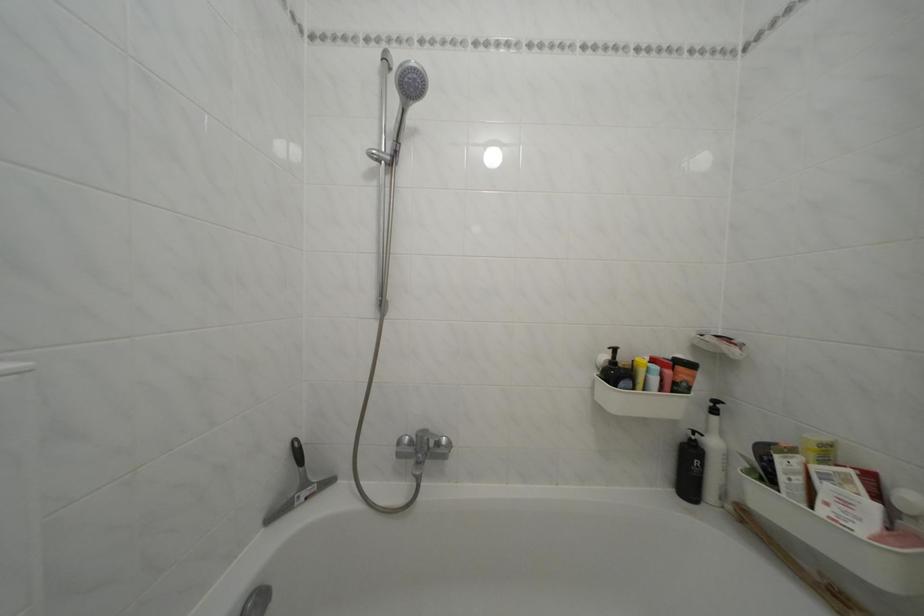
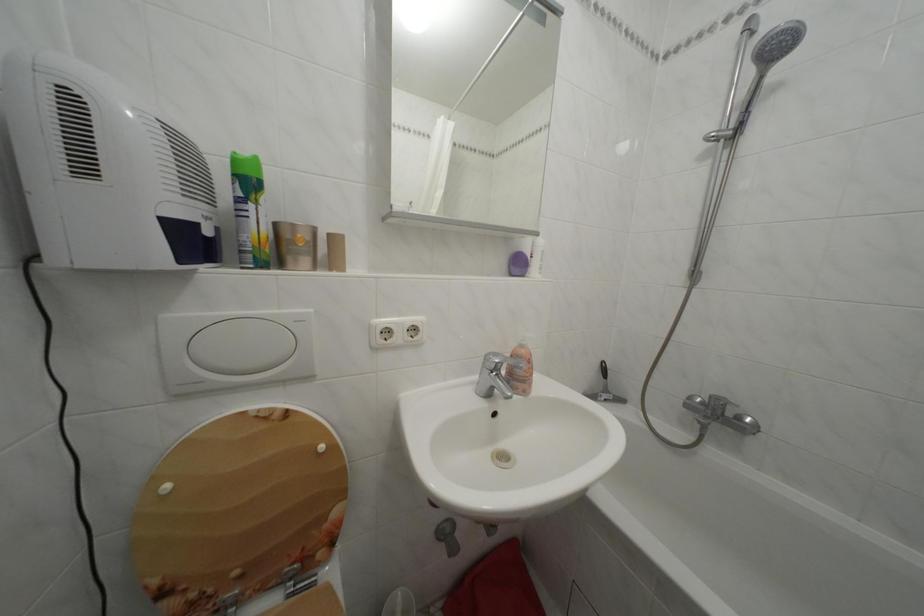
The point at (314, 491) is marked in the first image. Where is the corresponding point in the second image?

(614, 397)